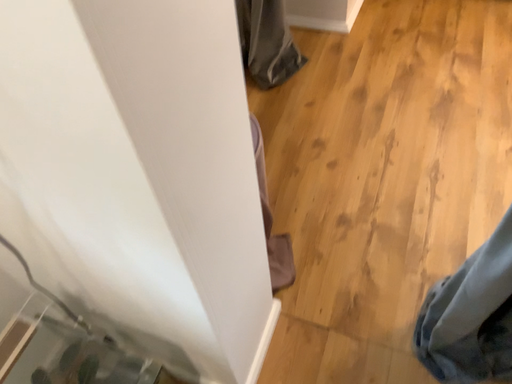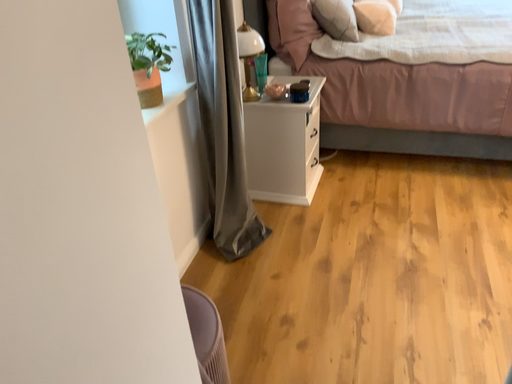
Question: How did the camera likely rotate when shooting the video?

Choices:
 (A) rotated upward
 (B) rotated downward

Answer: (A)